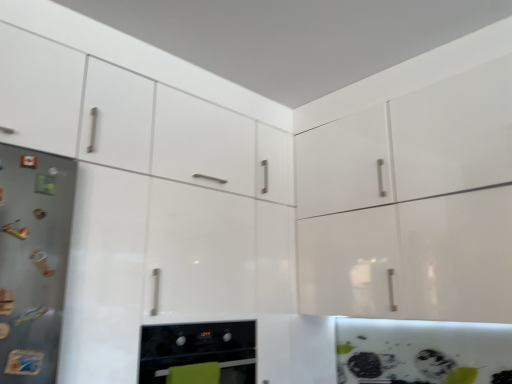
Question: Considering the positions of matte black oven at lower center and satin steel refrigerator at left in the image, is matte black oven at lower center wider or thinner than satin steel refrigerator at left?

Choices:
 (A) wide
 (B) thin

Answer: (A)

Question: Is matte black oven at lower center spatially inside satin steel refrigerator at left, or outside of it?

Choices:
 (A) outside
 (B) inside

Answer: (A)

Question: From the image's perspective, is matte black oven at lower center above or below satin steel refrigerator at left?

Choices:
 (A) above
 (B) below

Answer: (B)

Question: From the image's perspective, relative to matte black oven at lower center, is satin steel refrigerator at left above or below?

Choices:
 (A) above
 (B) below

Answer: (A)

Question: Considering the positions of satin steel refrigerator at left and matte black oven at lower center in the image, is satin steel refrigerator at left taller or shorter than matte black oven at lower center?

Choices:
 (A) short
 (B) tall

Answer: (B)

Question: In the image, is satin steel refrigerator at left positioned in front of or behind matte black oven at lower center?

Choices:
 (A) front
 (B) behind

Answer: (A)

Question: Visually, is satin steel refrigerator at left positioned to the left or to the right of matte black oven at lower center?

Choices:
 (A) left
 (B) right

Answer: (A)